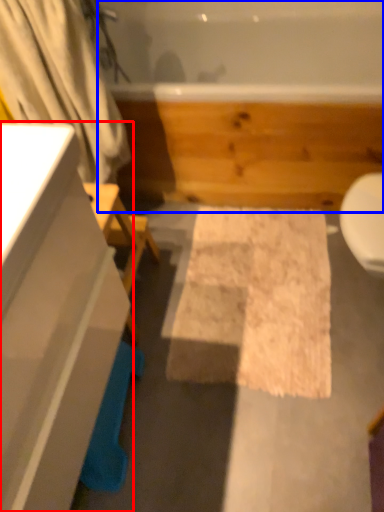
Question: Which point is closer to the camera, bathroom cabinet (highlighted by a red box) or jacuzzi (highlighted by a blue box)?

Choices:
 (A) bathroom cabinet
 (B) jacuzzi

Answer: (A)